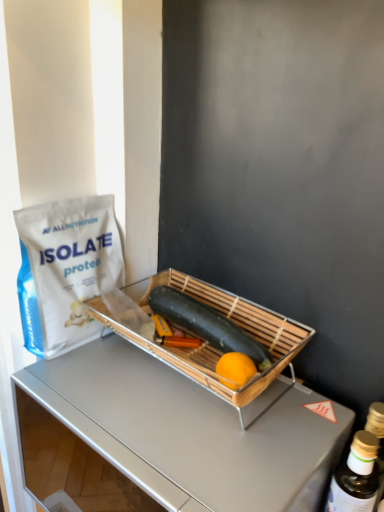
Find the location of `vacant area that is in front of bamboo tray at center`. vacant area that is in front of bamboo tray at center is located at coordinates (190, 441).